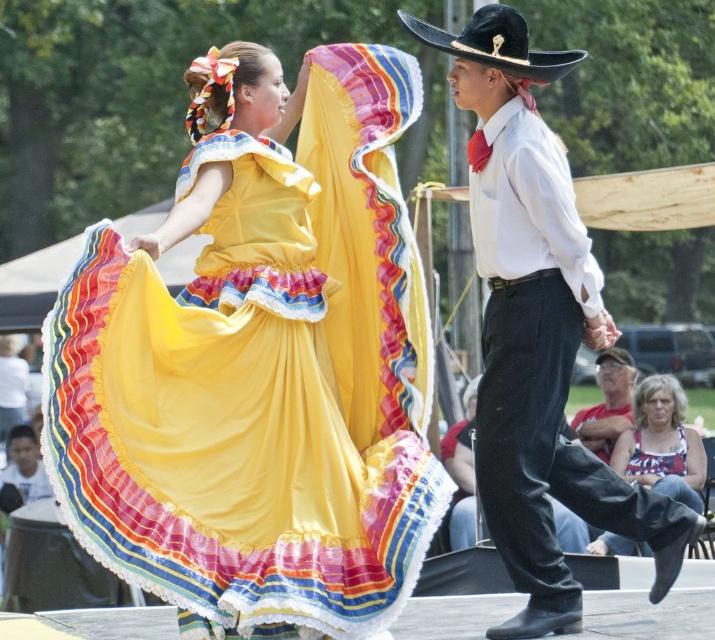
Question: Can you confirm if silky yellow dress at center is positioned to the left of black felt cowboy hat at upper center?

Choices:
 (A) yes
 (B) no

Answer: (A)

Question: Can you confirm if silky yellow dress at center is wider than white cotton shirt at center?

Choices:
 (A) no
 (B) yes

Answer: (B)

Question: Which point is closer to the camera?

Choices:
 (A) (608, 429)
 (B) (490, 456)

Answer: (B)

Question: Which object is closer to the camera taking this photo?

Choices:
 (A) silky yellow dress at center
 (B) white textured tank top at lower right
 (C) white cotton shirt at center

Answer: (A)

Question: Which point is closer to the camera?

Choices:
 (A) (674, 480)
 (B) (508, 24)

Answer: (B)

Question: Does silky yellow dress at center have a lesser width compared to white cotton shirt at center?

Choices:
 (A) yes
 (B) no

Answer: (B)